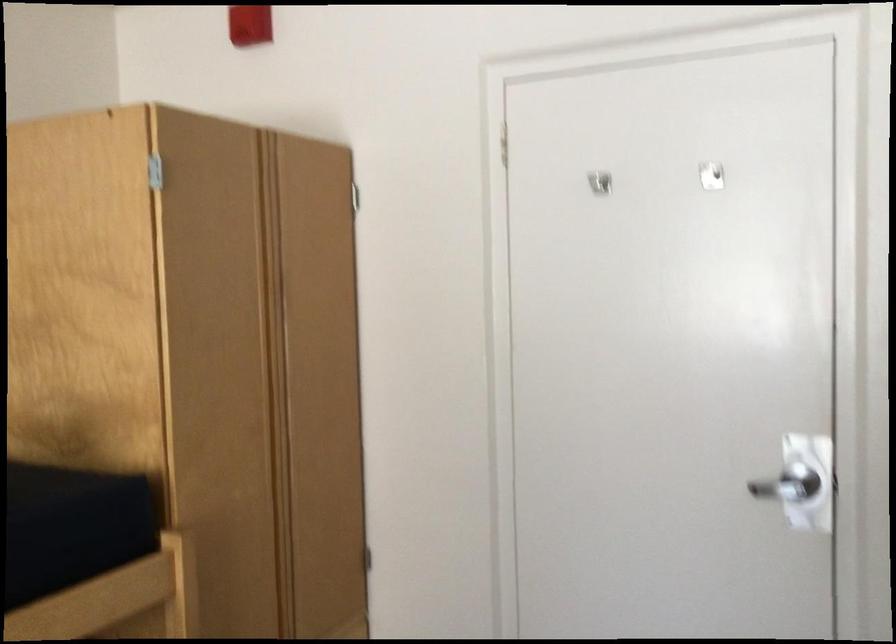
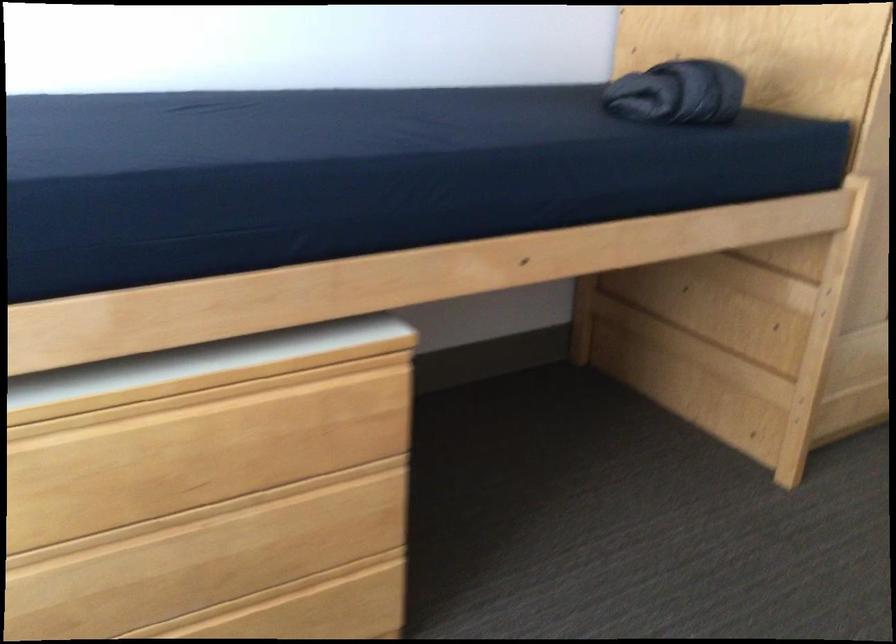
Based on the continuous images, in which direction is the camera rotating?

The camera rotated toward left-down.